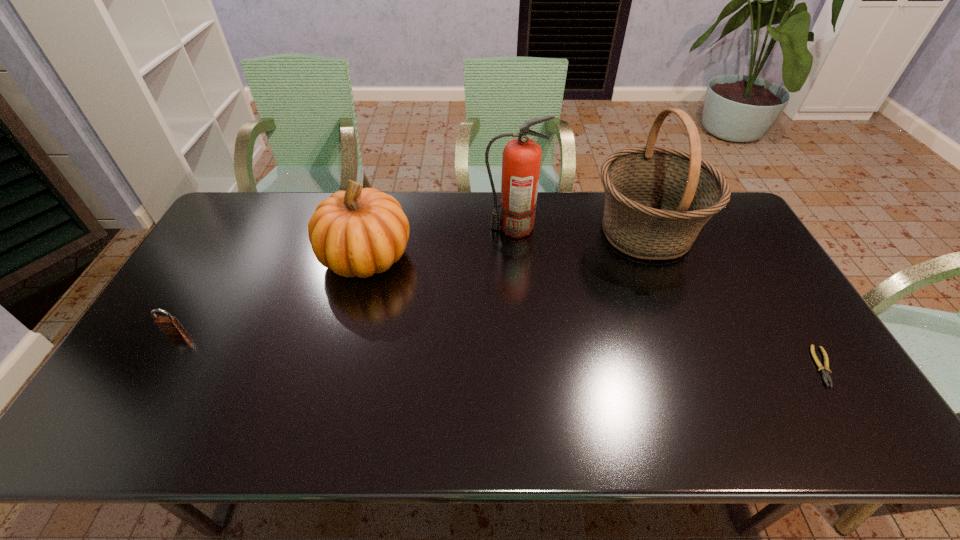
Image resolution: width=960 pixels, height=540 pixels. In order to click on basket in this screenshot , I will do `click(657, 199)`.

At what (x,y) coordinates should I click in order to perform the action: click on the third object from left to right. Please return your answer as a coordinate pair (x, y). Looking at the image, I should click on (521, 160).

I want to click on the fourth object from right to left, so click(x=358, y=232).

In order to click on pumpkin in this screenshot , I will do `click(358, 232)`.

I want to click on padlock, so click(x=169, y=325).

Image resolution: width=960 pixels, height=540 pixels. What are the coordinates of `the second nearest object` in the screenshot? It's located at (169, 325).

This screenshot has width=960, height=540. What are the coordinates of `pliers` in the screenshot? It's located at (825, 371).

Where is `the nearest object`? The width and height of the screenshot is (960, 540). the nearest object is located at coordinates (825, 371).

The height and width of the screenshot is (540, 960). In order to click on vacant space situated on the right of the basket in this screenshot , I will do `click(733, 232)`.

Where is `free space located 0.210m on the nozzle of the third object from left to right`? The image size is (960, 540). free space located 0.210m on the nozzle of the third object from left to right is located at coordinates (422, 228).